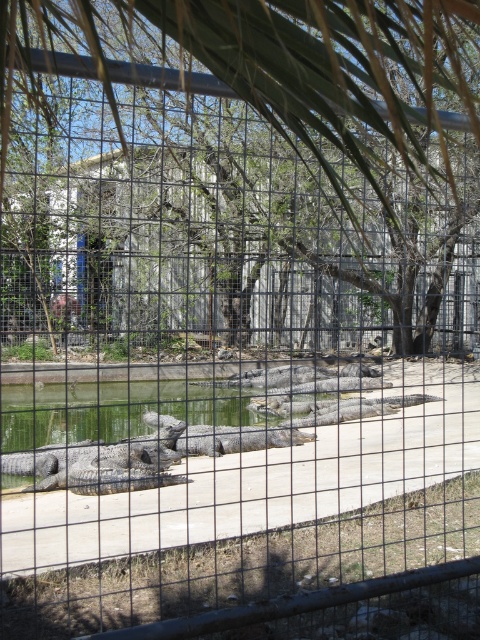
Question: Is green leafy tree at center positioned behind green matte water at center?

Choices:
 (A) no
 (B) yes

Answer: (A)

Question: Among these points, which one is farthest from the camera?

Choices:
 (A) (357, 429)
 (B) (137, 442)
 (C) (119, 83)

Answer: (C)

Question: Which point is farther from the camera taking this photo?

Choices:
 (A) (268, 380)
 (B) (129, 404)

Answer: (A)

Question: Does metal wire fence at center appear over green matte water at center?

Choices:
 (A) yes
 (B) no

Answer: (A)

Question: Which point appears closest to the camera in this image?

Choices:
 (A) (16, 0)
 (B) (111, 436)
 (C) (11, 477)
 (D) (213, 444)

Answer: (A)

Question: Does metal wire fence at center have a lesser width compared to gray textured crocodile at center?

Choices:
 (A) yes
 (B) no

Answer: (B)